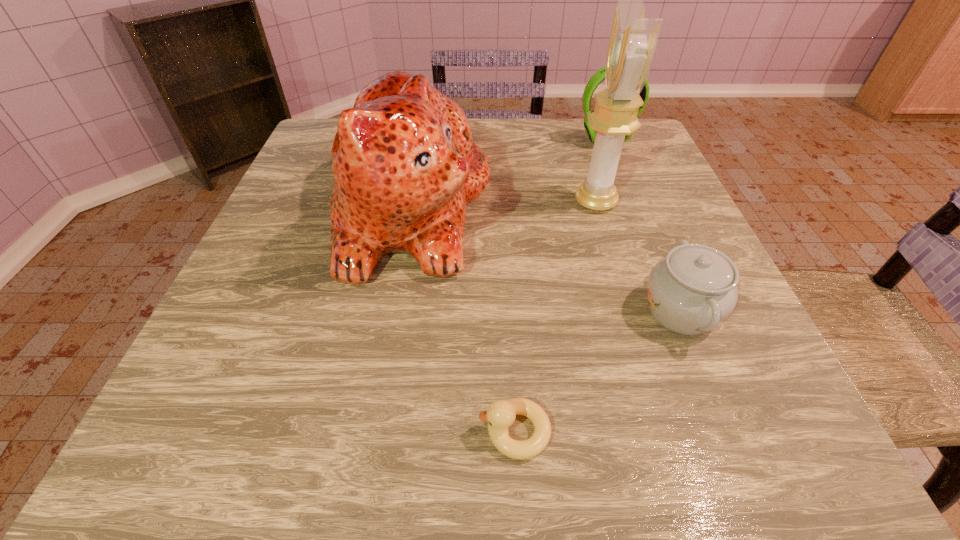
The image size is (960, 540). I want to click on award, so click(633, 38).

Image resolution: width=960 pixels, height=540 pixels. I want to click on the fourth shortest object, so pyautogui.click(x=405, y=166).

Locate an element on the screen. headset is located at coordinates (599, 76).

Where is `the fourth tallest object`? The image size is (960, 540). the fourth tallest object is located at coordinates (692, 290).

Where is `the shortest object`? This screenshot has height=540, width=960. the shortest object is located at coordinates (500, 415).

You are a GUI agent. You are given a task and a screenshot of the screen. Output one action in this format:
    pyautogui.click(x=<x>, y=<y>)
    Task: Click on the nearest object
    
    Given the screenshot: What is the action you would take?
    pyautogui.click(x=500, y=415)

This screenshot has width=960, height=540. I want to click on vacant space located on the front-facing side of the award, so click(x=404, y=202).

The width and height of the screenshot is (960, 540). Find the location of `vacant space located on the front-facing side of the award`. vacant space located on the front-facing side of the award is located at coordinates (409, 202).

You are a GUI agent. You are given a task and a screenshot of the screen. Output one action in this format:
    pyautogui.click(x=<x>, y=<y>)
    Task: Click on the vacant point located on the front-facing side of the award
    The width and height of the screenshot is (960, 540).
    Given the screenshot: What is the action you would take?
    pyautogui.click(x=533, y=202)

Where is `vacant region located on the face of the fourth shortest object`? The height and width of the screenshot is (540, 960). vacant region located on the face of the fourth shortest object is located at coordinates (620, 207).